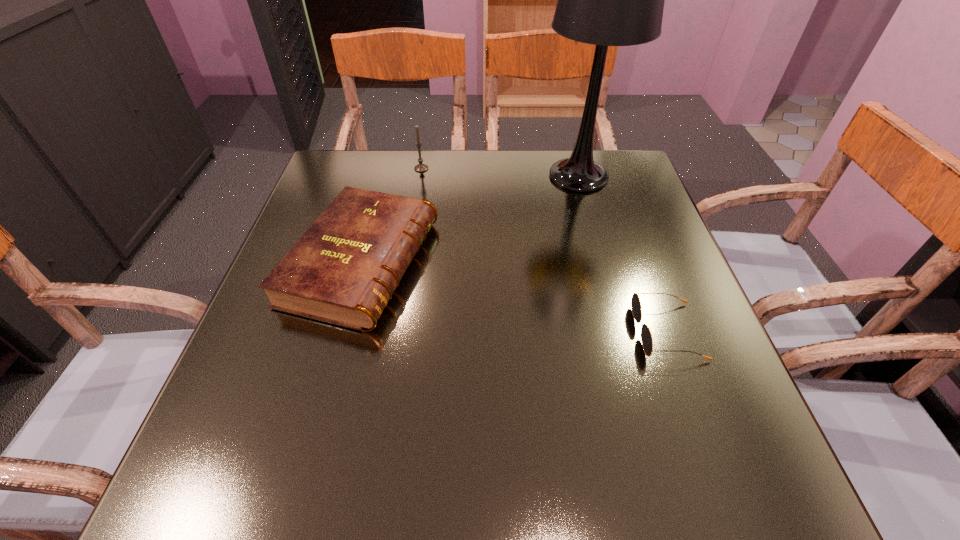
Find the location of `table lamp that is at the far edge`. table lamp that is at the far edge is located at coordinates (606, 0).

Where is `candle located in the far edge section of the desktop`? This screenshot has height=540, width=960. candle located in the far edge section of the desktop is located at coordinates (420, 167).

Locate an element on the screen. This screenshot has height=540, width=960. object located in the left edge section of the desktop is located at coordinates (344, 269).

Where is `table lamp that is at the right edge`? This screenshot has height=540, width=960. table lamp that is at the right edge is located at coordinates (606, 0).

Locate an element on the screen. sunglasses present at the right edge is located at coordinates (647, 341).

Image resolution: width=960 pixels, height=540 pixels. Find the location of `object that is at the far right corner`. object that is at the far right corner is located at coordinates (606, 0).

The height and width of the screenshot is (540, 960). Find the location of `vacant space at the far edge of the desktop`. vacant space at the far edge of the desktop is located at coordinates (547, 180).

You are a GUI agent. You are given a task and a screenshot of the screen. Output one action in this format:
    pyautogui.click(x=<x>, y=<y>)
    Task: Click on the vacant space at the near edge
    
    Given the screenshot: What is the action you would take?
    pyautogui.click(x=421, y=507)

Where is `blank space at the left edge of the desktop`? blank space at the left edge of the desktop is located at coordinates (325, 354).

I want to click on vacant region at the right edge, so click(595, 201).